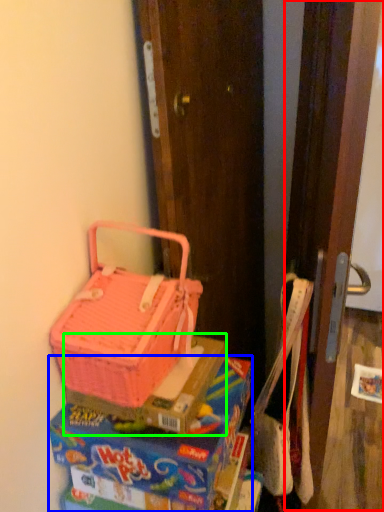
Question: Which object is positioned farthest from screen door (highlighted by a red box)? Select from lunch box (highlighted by a blue box) and box (highlighted by a green box).

Choices:
 (A) lunch box
 (B) box

Answer: (B)